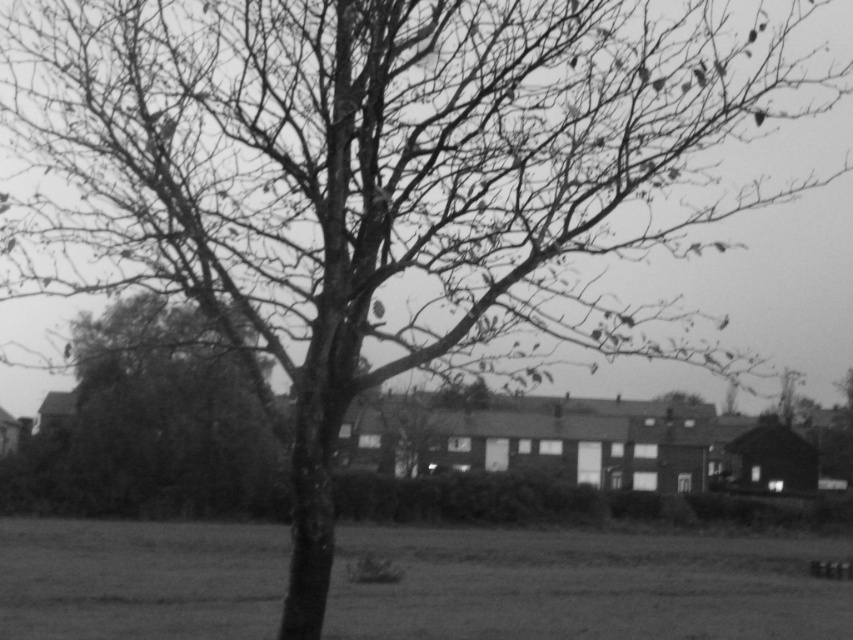
Question: Observing the image, what is the correct spatial positioning of grassy plain at lower center in reference to smooth bark tree at center?

Choices:
 (A) below
 (B) above

Answer: (A)

Question: Among these objects, which one is farthest from the camera?

Choices:
 (A) smooth bark tree at center
 (B) grassy plain at lower center

Answer: (B)

Question: Which of the following is the farthest from the observer?

Choices:
 (A) (96, 355)
 (B) (686, 557)

Answer: (B)

Question: Does grassy plain at lower center have a larger size compared to smooth bark tree at center?

Choices:
 (A) no
 (B) yes

Answer: (B)

Question: Does grassy plain at lower center have a lesser width compared to smooth bark tree at center?

Choices:
 (A) yes
 (B) no

Answer: (B)